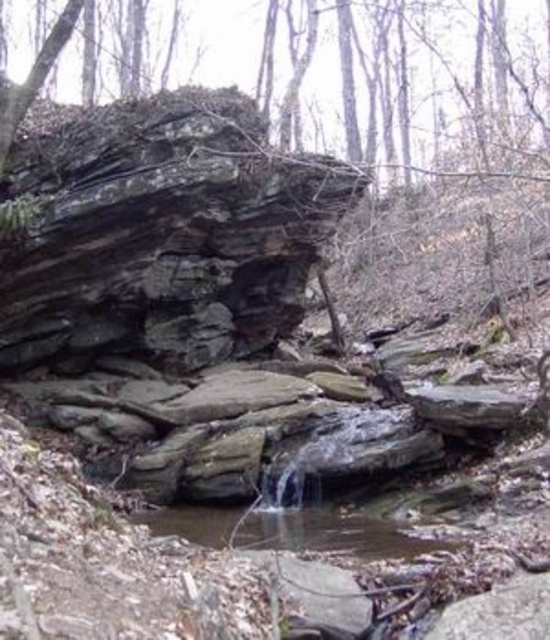
Question: Can you confirm if rusty stone rock at upper left is thinner than clear water stream at center?

Choices:
 (A) yes
 (B) no

Answer: (A)

Question: Which of the following is the closest to the observer?

Choices:
 (A) (75, 212)
 (B) (206, 529)

Answer: (B)

Question: Observing the image, what is the correct spatial positioning of rusty stone rock at upper left in reference to clear water stream at center?

Choices:
 (A) below
 (B) above

Answer: (B)

Question: Does rusty stone rock at upper left appear under clear water stream at center?

Choices:
 (A) no
 (B) yes

Answer: (A)

Question: Among these objects, which one is farthest from the camera?

Choices:
 (A) clear water stream at center
 (B) rusty stone rock at upper left

Answer: (B)

Question: Which of the following is the closest to the observer?

Choices:
 (A) clear water stream at center
 (B) rusty stone rock at upper left

Answer: (A)